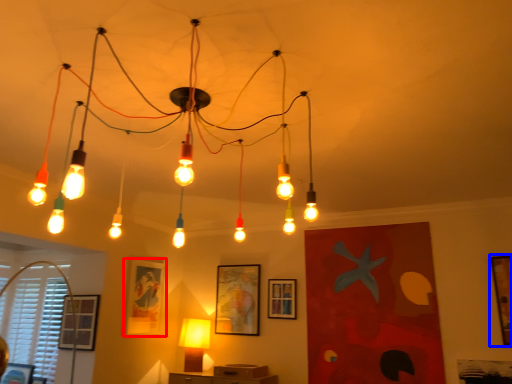
Question: Which object appears closest to the camera in this image, picture frame (highlighted by a red box) or picture frame (highlighted by a blue box)?

Choices:
 (A) picture frame
 (B) picture frame

Answer: (B)